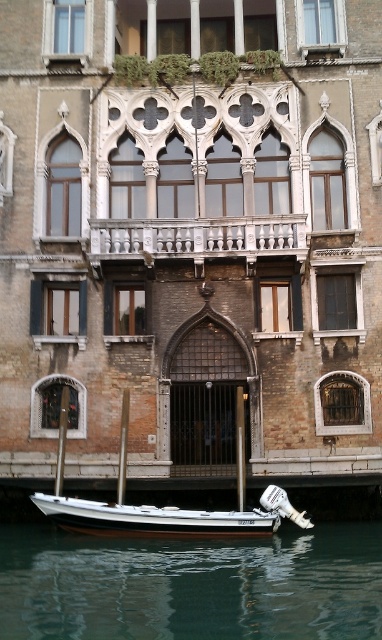
Question: Can you confirm if greenish water at lower center is bigger than white stone railing at center?

Choices:
 (A) no
 (B) yes

Answer: (B)

Question: Among these objects, which one is nearest to the camera?

Choices:
 (A) greenish water at lower center
 (B) white polished wood boat at lower center

Answer: (A)

Question: Can you confirm if white stone railing at center is smaller than white polished wood boat at lower center?

Choices:
 (A) no
 (B) yes

Answer: (B)

Question: Can you confirm if greenish water at lower center is smaller than white polished wood boat at lower center?

Choices:
 (A) no
 (B) yes

Answer: (A)

Question: Which of these objects is positioned closest to the white stone railing at center?

Choices:
 (A) greenish water at lower center
 (B) white polished wood boat at lower center

Answer: (B)

Question: Estimate the real-world distances between objects in this image. Which object is farther from the white polished wood boat at lower center?

Choices:
 (A) greenish water at lower center
 (B) white stone railing at center

Answer: (B)